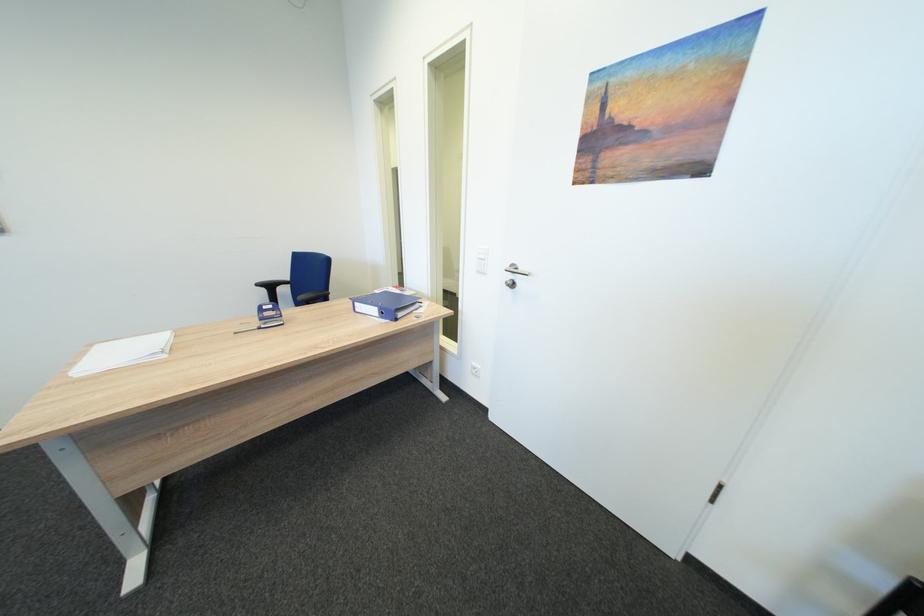
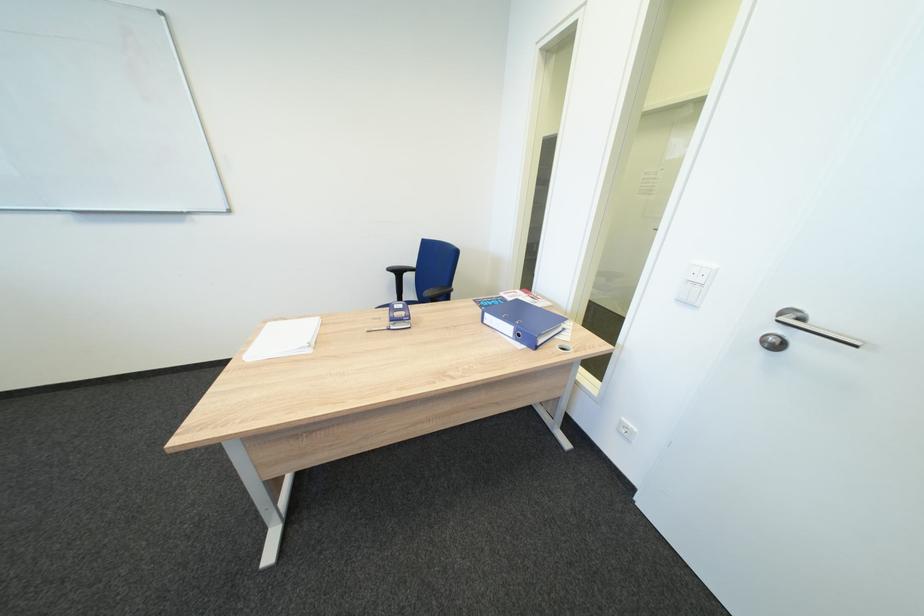
Where in the second image is the point corresponding to the point at 524,286 from the first image?

(784, 346)